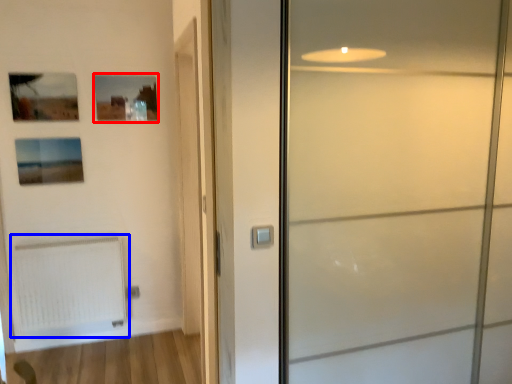
Question: Which object is closer to the camera taking this photo, picture frame (highlighted by a red box) or radiator (highlighted by a blue box)?

Choices:
 (A) picture frame
 (B) radiator

Answer: (B)